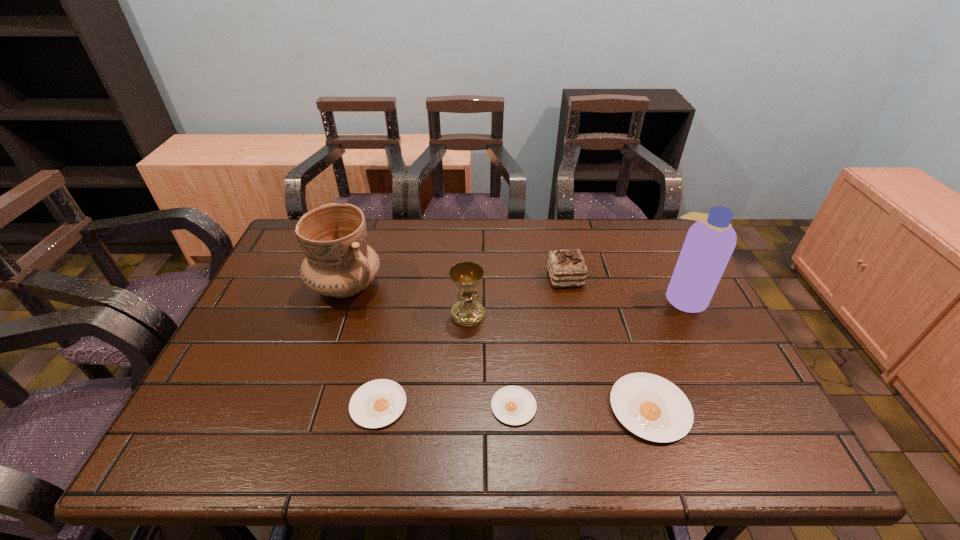
The width and height of the screenshot is (960, 540). Find the location of `free point that keeps the egg yolks evenly spaced on the left`. free point that keeps the egg yolks evenly spaced on the left is located at coordinates (244, 403).